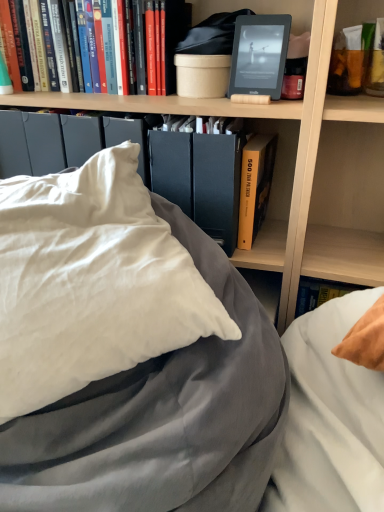
Question: Does matte black kindle at upper center, which is the 2th paperback book in bottom-to-top order, have a lesser height compared to white satin pillow at center?

Choices:
 (A) no
 (B) yes

Answer: (B)

Question: Is matte black kindle at upper center, placed as the 1th paperback book when sorted from top to bottom, smaller than white satin pillow at center?

Choices:
 (A) yes
 (B) no

Answer: (A)

Question: Is matte black kindle at upper center, placed as the 1th paperback book when sorted from top to bottom, positioned behind white satin pillow at center?

Choices:
 (A) no
 (B) yes

Answer: (B)

Question: Can you confirm if matte black kindle at upper center, placed as the 1th paperback book when sorted from top to bottom, is wider than white satin pillow at center?

Choices:
 (A) yes
 (B) no

Answer: (B)

Question: Is white satin pillow at center located within matte black kindle at upper center, which is the 2th paperback book in bottom-to-top order?

Choices:
 (A) yes
 (B) no

Answer: (B)

Question: Is matte black kindle at upper center, placed as the 1th paperback book when sorted from top to bottom, positioned beyond the bounds of white satin pillow at center?

Choices:
 (A) yes
 (B) no

Answer: (A)

Question: Considering the relative sizes of matte black folder at center, which appears as the 1th paperback book when ordered from the bottom, and white satin pillow at center in the image provided, is matte black folder at center, which appears as the 1th paperback book when ordered from the bottom, thinner than white satin pillow at center?

Choices:
 (A) yes
 (B) no

Answer: (A)

Question: From the image's perspective, would you say matte black folder at center, the 2th paperback book from the top, is shown under white satin pillow at center?

Choices:
 (A) no
 (B) yes

Answer: (A)

Question: Is matte black folder at center, which appears as the 1th paperback book when ordered from the bottom, further to the viewer compared to white satin pillow at center?

Choices:
 (A) no
 (B) yes

Answer: (B)

Question: Is the surface of matte black folder at center, which appears as the 1th paperback book when ordered from the bottom, in direct contact with white satin pillow at center?

Choices:
 (A) no
 (B) yes

Answer: (A)

Question: From the image's perspective, does matte black folder at center, which appears as the 1th paperback book when ordered from the bottom, appear higher than white satin pillow at center?

Choices:
 (A) yes
 (B) no

Answer: (A)

Question: Does matte black folder at center, the 2th paperback book from the top, have a lesser height compared to white satin pillow at center?

Choices:
 (A) no
 (B) yes

Answer: (B)

Question: Is hardcover book at upper left, arranged as the 1th book when viewed from the left, oriented away from wooden bookshelf at upper center?

Choices:
 (A) yes
 (B) no

Answer: (A)